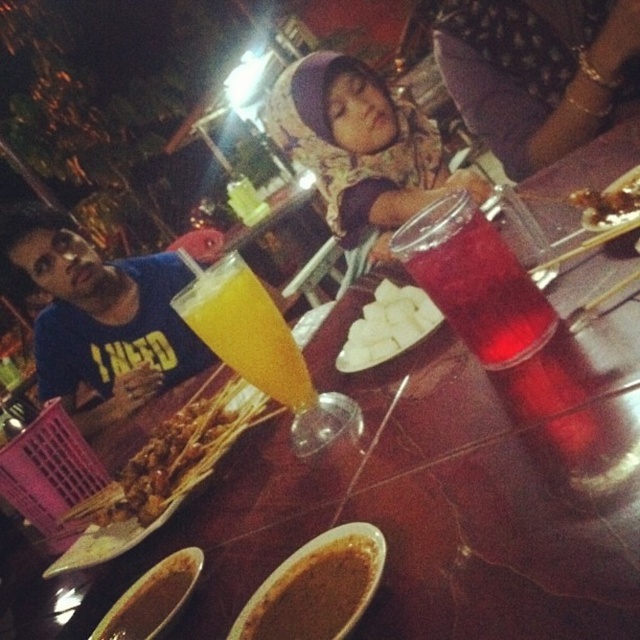
Between point (65, 225) and point (413, 225), which one is positioned behind?

The point (65, 225) is more distant.

Which of these two, blue jersey at left or translucent glass beverage at center right, stands taller?

With more height is blue jersey at left.

Where is `blue jersey at left`? This screenshot has width=640, height=640. blue jersey at left is located at coordinates (99, 314).

Where is `blue jersey at left`? The height and width of the screenshot is (640, 640). blue jersey at left is located at coordinates (99, 314).

Between translucent glass beverage at center right and savory skewers at center, which one appears on the left side from the viewer's perspective?

Positioned to the left is translucent glass beverage at center right.

Is translucent glass beverage at center right shorter than savory skewers at center?

No.

Locate an element on the screen. This screenshot has width=640, height=640. translucent glass beverage at center right is located at coordinates (474, 280).

Between blue jersey at left and translucent glass juice at center, which one appears on the right side from the viewer's perspective?

Positioned to the right is translucent glass juice at center.

Between point (106, 339) and point (218, 273), which one is positioned behind?

The point (106, 339) is behind.

Locate an element on the screen. The image size is (640, 640). blue jersey at left is located at coordinates (99, 314).

Find the location of `blue jersey at left`. blue jersey at left is located at coordinates (99, 314).